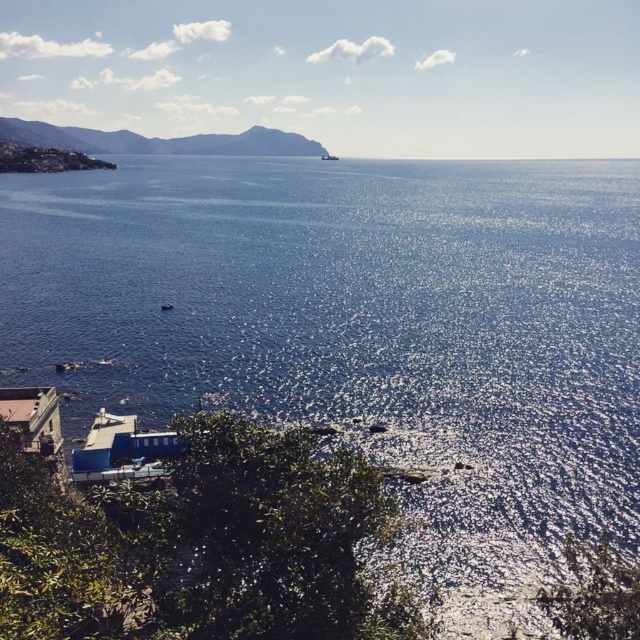
Where is `matte stone shoreline at lower left`? This screenshot has height=640, width=640. matte stone shoreline at lower left is located at coordinates (45, 160).

Is matte stone shoreline at lower left wider than metallic silver boat at center?

Indeed, matte stone shoreline at lower left has a greater width compared to metallic silver boat at center.

Does point (100, 168) come behind point (333, 161)?

No.

The image size is (640, 640). Find the location of `matte stone shoreline at lower left`. matte stone shoreline at lower left is located at coordinates (45, 160).